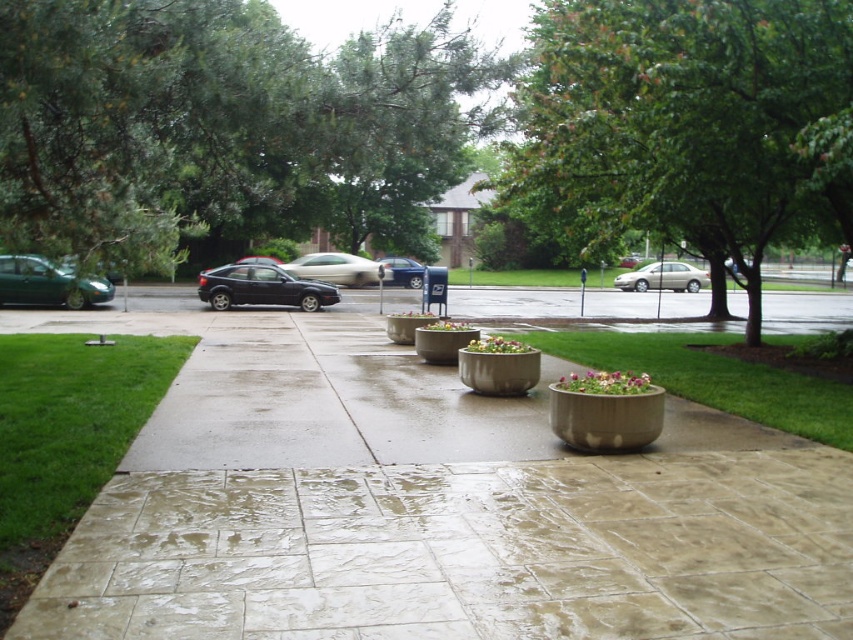
Question: Which object is farther from the camera taking this photo?

Choices:
 (A) purple matte flower pot at center
 (B) satin black hatchback at center

Answer: (B)

Question: Which point appears closest to the camera in this image?

Choices:
 (A) (479, 353)
 (B) (403, 260)
 (C) (454, 330)

Answer: (A)

Question: Does metallic silver sedan at center appear on the right side of green matte planter at center?

Choices:
 (A) yes
 (B) no

Answer: (A)

Question: Does purple matte flower pot at center lie behind green matte planter at center?

Choices:
 (A) yes
 (B) no

Answer: (B)

Question: In this image, where is green matte flower pot at center located relative to floral arrangement at center?

Choices:
 (A) left
 (B) right

Answer: (B)

Question: Which of the following is the closest to the observer?

Choices:
 (A) (451, 330)
 (B) (409, 272)

Answer: (A)